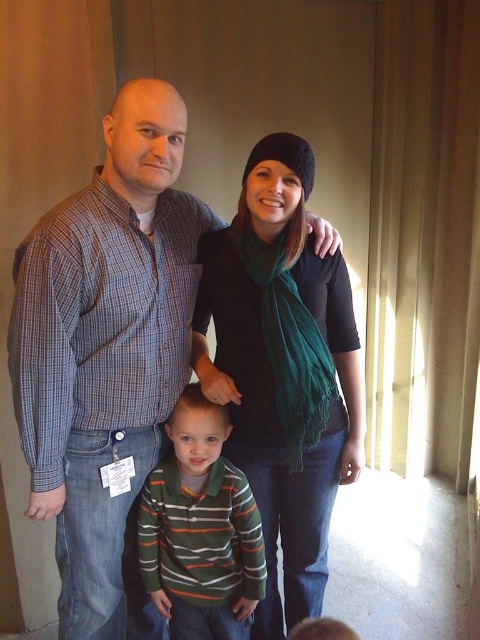
In the scene shown: You are a photographer trying to capture a group photo of the plaid shirt at center and the striped cotton shirt at center. To ensure both shirts are clearly visible in the frame, which shirt should you position closer to the camera?

The plaid shirt at center should be positioned closer to the camera because it is on the left side of the striped cotton shirt at center, so moving it forward will help ensure both are visible.